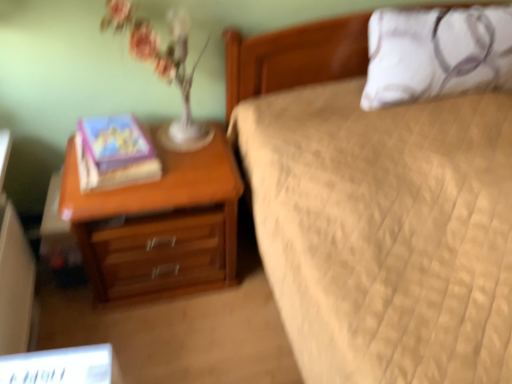
Locate an element on the screen. This screenshot has height=384, width=512. vacant area that is in front of translucent glass vase at upper left is located at coordinates pos(172,172).